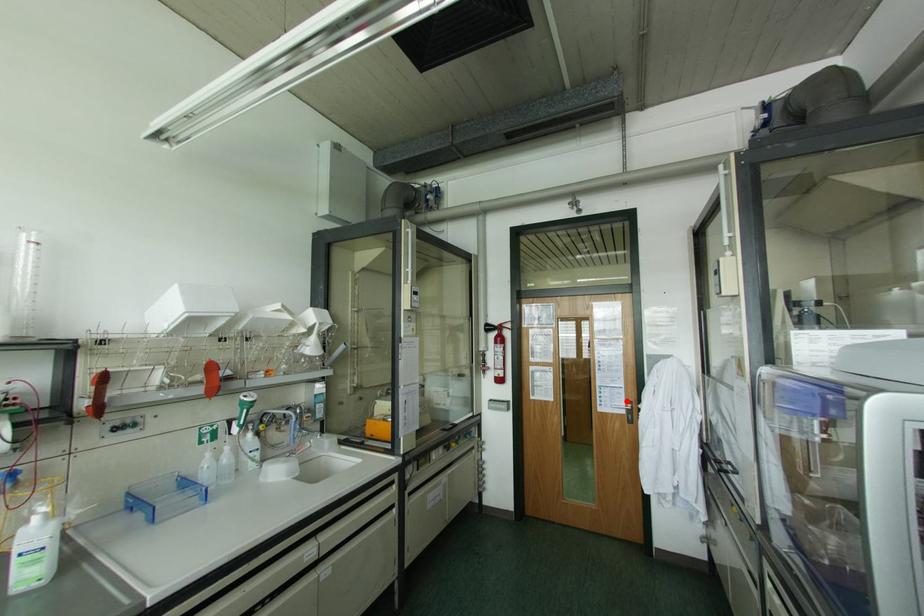
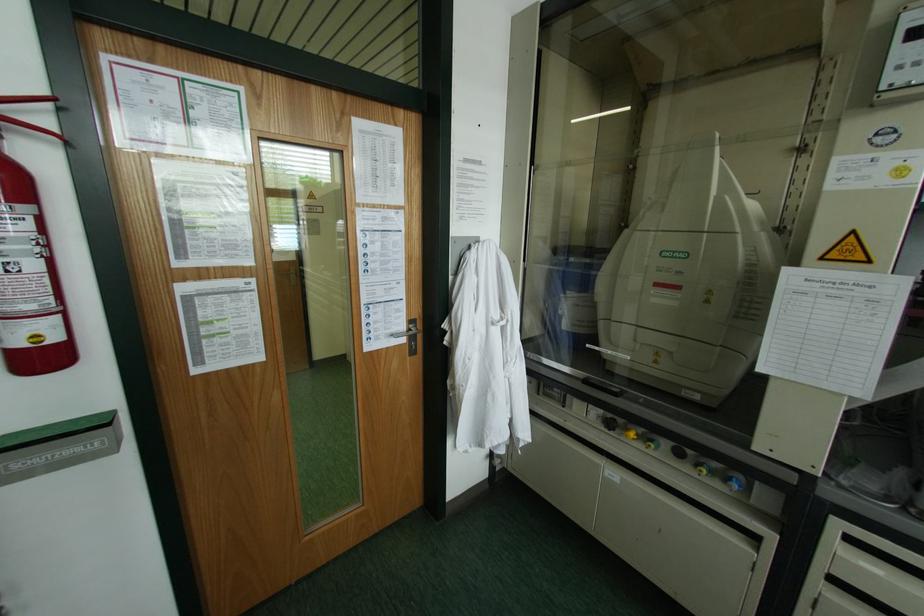
Where in the second image is the point corresponding to the highlighted location from the first image?

(409, 321)